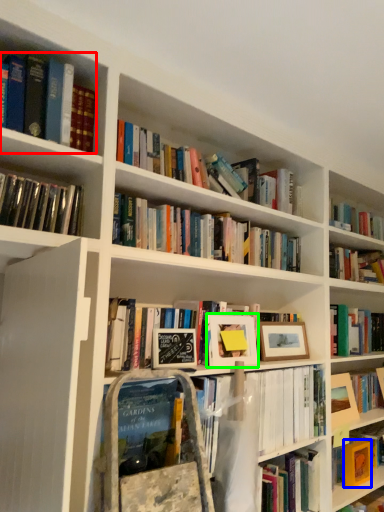
Question: Estimate the real-world distances between objects in this image. Which object is farther from book (highlighted by a red box), paperback book (highlighted by a blue box) or picture frame (highlighted by a green box)?

Choices:
 (A) paperback book
 (B) picture frame

Answer: (A)